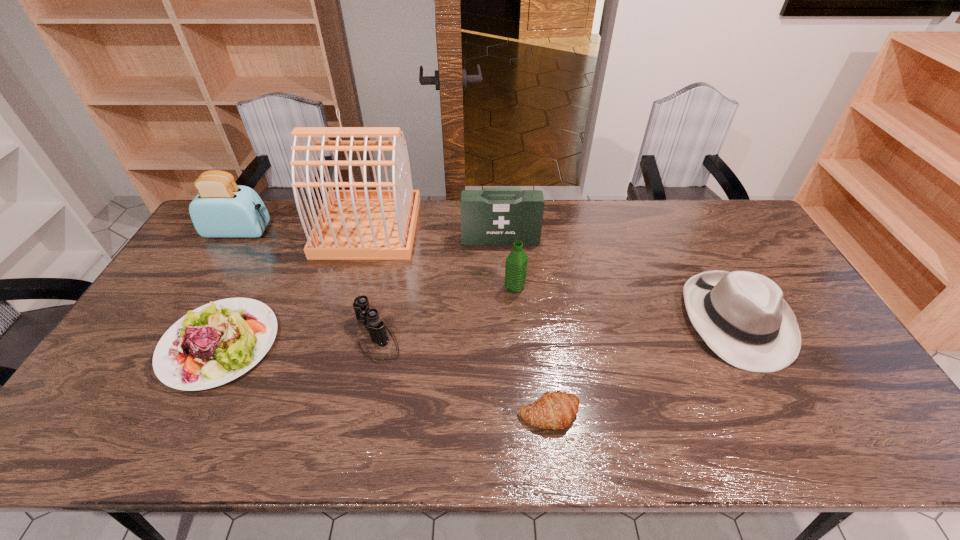
The height and width of the screenshot is (540, 960). I want to click on the first-aid kit located in the far edge section of the desktop, so click(493, 216).

Where is `object that is at the near edge`? This screenshot has width=960, height=540. object that is at the near edge is located at coordinates (555, 410).

The image size is (960, 540). I want to click on toaster situated at the left edge, so click(x=222, y=209).

Find the location of a particular element. salad plate located in the left edge section of the desktop is located at coordinates (216, 343).

Image resolution: width=960 pixels, height=540 pixels. Find the location of `object at the right edge`. object at the right edge is located at coordinates click(x=742, y=316).

Find the location of a particular element. The image size is (960, 540). object at the far left corner is located at coordinates point(222,209).

The height and width of the screenshot is (540, 960). In the image, there is a desktop. Find the location of `vacant area at the far edge`. vacant area at the far edge is located at coordinates (294, 238).

Locate an element on the screen. vacant area at the near edge of the desktop is located at coordinates (695, 431).

Identify the location of vacant region at the left edge of the desktop. (228, 264).

In the image, there is a desktop. Where is `vacant space at the right edge`? This screenshot has height=540, width=960. vacant space at the right edge is located at coordinates (825, 348).